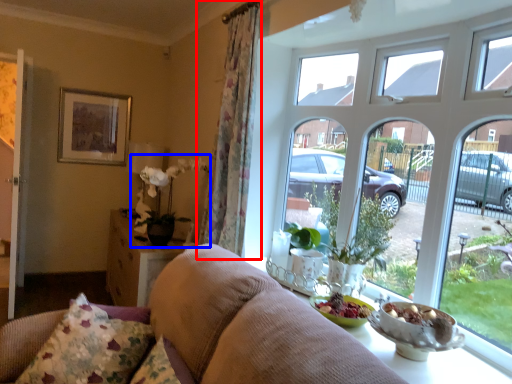
Question: Which point is further to the camera, curtain (highlighted by a red box) or floral arrangement (highlighted by a blue box)?

Choices:
 (A) curtain
 (B) floral arrangement

Answer: (B)